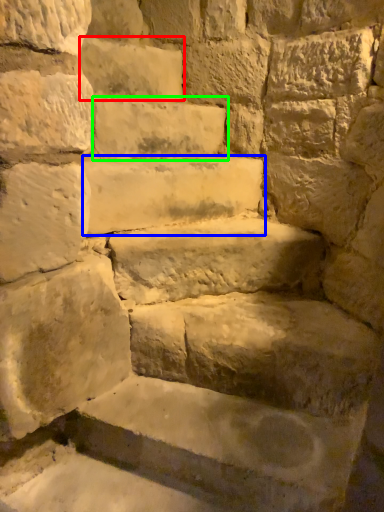
Question: Considering the real-world distances, which object is closest to brick (highlighted by a red box)? stone (highlighted by a blue box) or brick (highlighted by a green box).

Choices:
 (A) stone
 (B) brick

Answer: (B)